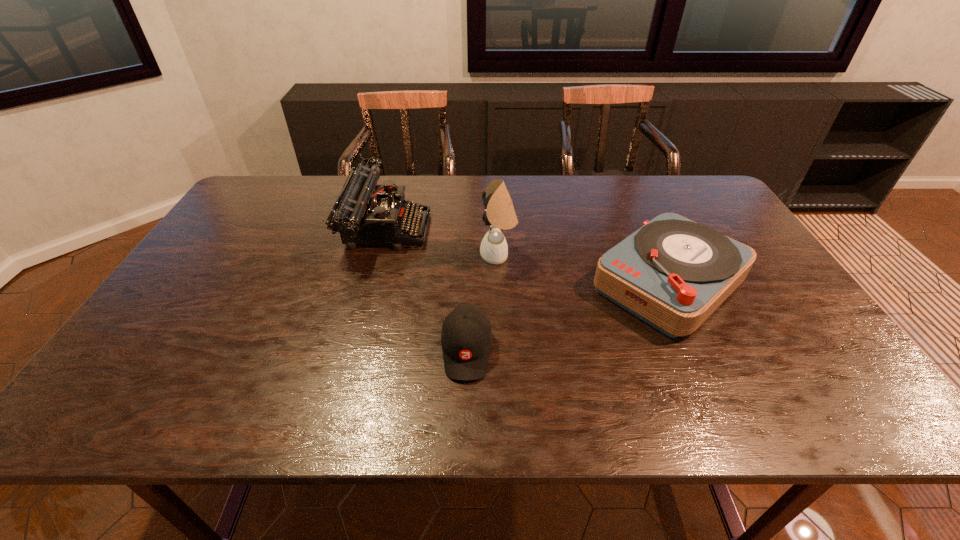
At what (x,y) coordinates should I click in order to perform the action: click on vacant area located 0.240m on the back of the rightmost object. Please return your answer as a coordinate pair (x, y). This screenshot has width=960, height=540. Looking at the image, I should click on (628, 194).

In order to click on vacant region located with a logo on the front of the baseball cap in this screenshot , I will do `click(465, 403)`.

Identify the location of object at the far edge. The height and width of the screenshot is (540, 960). (362, 216).

Identify the location of object that is at the right edge. (673, 273).

Where is `vacant space at the far edge of the desktop`? vacant space at the far edge of the desktop is located at coordinates (457, 183).

Find the location of `vacant space at the near edge of the desktop`. vacant space at the near edge of the desktop is located at coordinates (662, 389).

At what (x,y) coordinates should I click in order to perform the action: click on vacant region at the left edge of the desktop. Please return your answer as a coordinate pair (x, y). This screenshot has width=960, height=540. Looking at the image, I should click on (197, 274).

The image size is (960, 540). Find the location of `free location at the right edge`. free location at the right edge is located at coordinates (767, 338).

Find the location of `vacant region at the far right corner of the desktop`. vacant region at the far right corner of the desktop is located at coordinates (680, 183).

This screenshot has height=540, width=960. In the image, there is a desktop. What are the coordinates of `vacant area at the near right corner` in the screenshot? It's located at (819, 402).